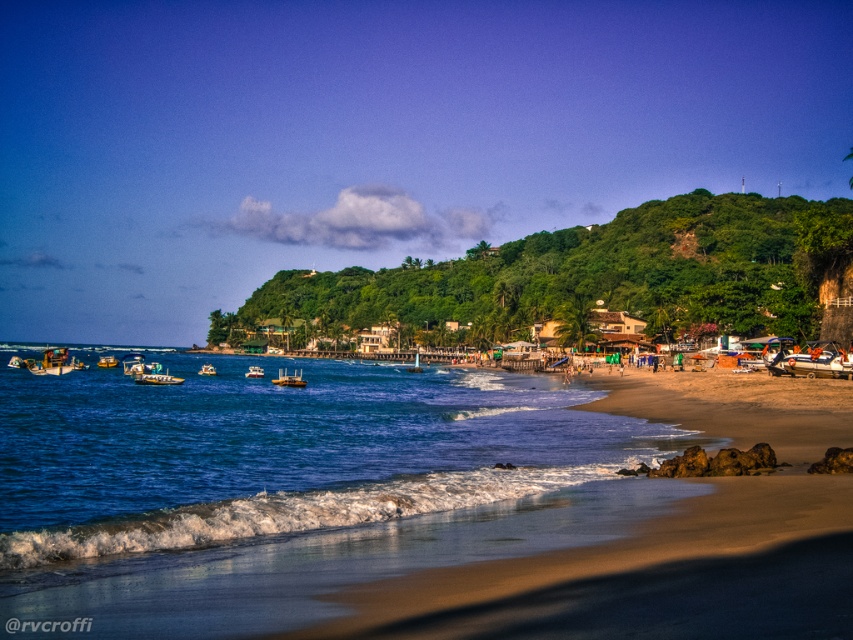
You are standing on the beach and see the white glossy boat at center and the green plastic boat at center. Which boat appears closer to you?

The white glossy boat at center appears closer to you because it is further to the viewer than the green plastic boat at center.